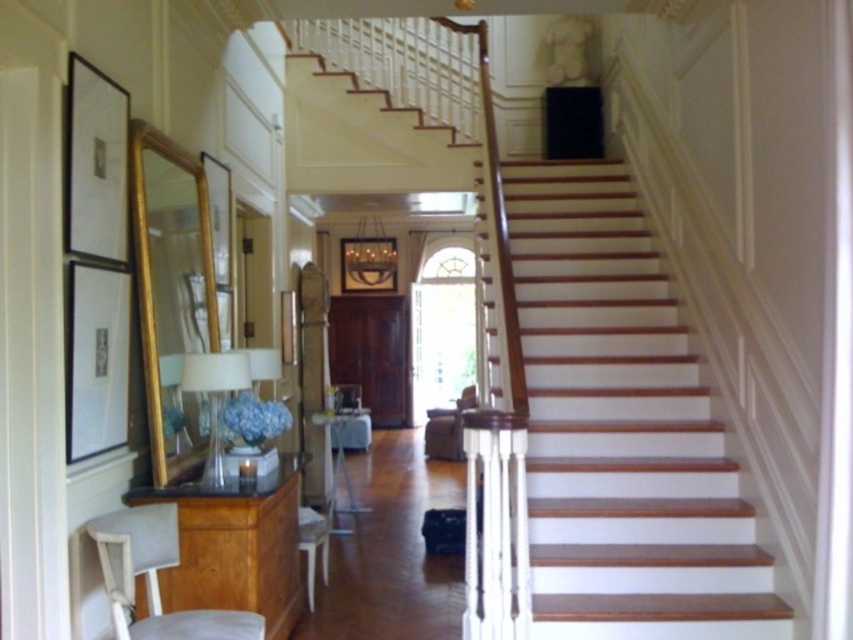
Is matte black picture frame at left positioned at the back of wooden frame at center?

No, it is in front of wooden frame at center.

Can you confirm if matte black picture frame at left is positioned below wooden frame at center?

Correct, matte black picture frame at left is located below wooden frame at center.

You are a GUI agent. You are given a task and a screenshot of the screen. Output one action in this format:
    pyautogui.click(x=<x>, y=<y>)
    Task: Click on the matte black picture frame at left
    The image size is (853, 640).
    Given the screenshot: What is the action you would take?
    pyautogui.click(x=96, y=260)

Locate an element on the screen. The width and height of the screenshot is (853, 640). matte black picture frame at left is located at coordinates (96, 260).

Between white wood stairs at upper center and beige fabric armchair at lower left, which one appears on the left side from the viewer's perspective?

beige fabric armchair at lower left

This screenshot has height=640, width=853. What do you see at coordinates (621, 428) in the screenshot? I see `white wood stairs at upper center` at bounding box center [621, 428].

Describe the element at coordinates (621, 428) in the screenshot. I see `white wood stairs at upper center` at that location.

Identify the location of white wood stairs at upper center. (621, 428).

Between beige fabric armchair at lower left and wooden picture frame at center, which one appears on the right side from the viewer's perspective?

Positioned to the right is beige fabric armchair at lower left.

Does beige fabric armchair at lower left have a greater height compared to wooden picture frame at center?

Indeed, beige fabric armchair at lower left has a greater height compared to wooden picture frame at center.

Locate an element on the screen. This screenshot has width=853, height=640. beige fabric armchair at lower left is located at coordinates (155, 579).